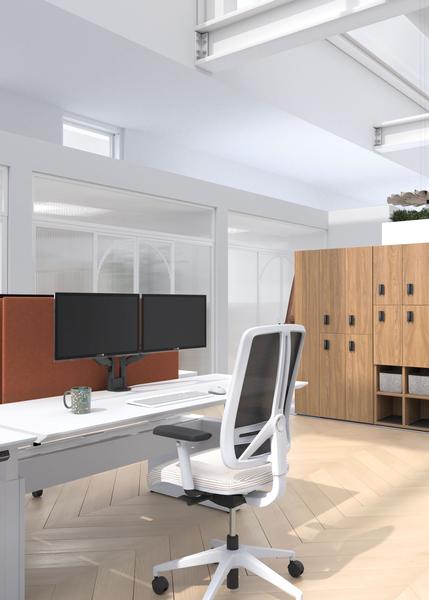
The height and width of the screenshot is (600, 429). Find the location of `floor`. floor is located at coordinates (129, 530).